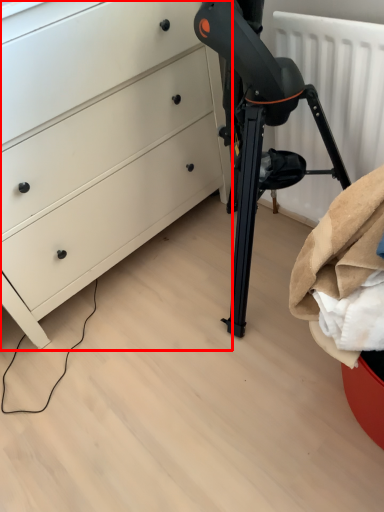
Question: In this image, where is chest of drawers (annotated by the red box) located relative to radiator?

Choices:
 (A) left
 (B) right

Answer: (A)